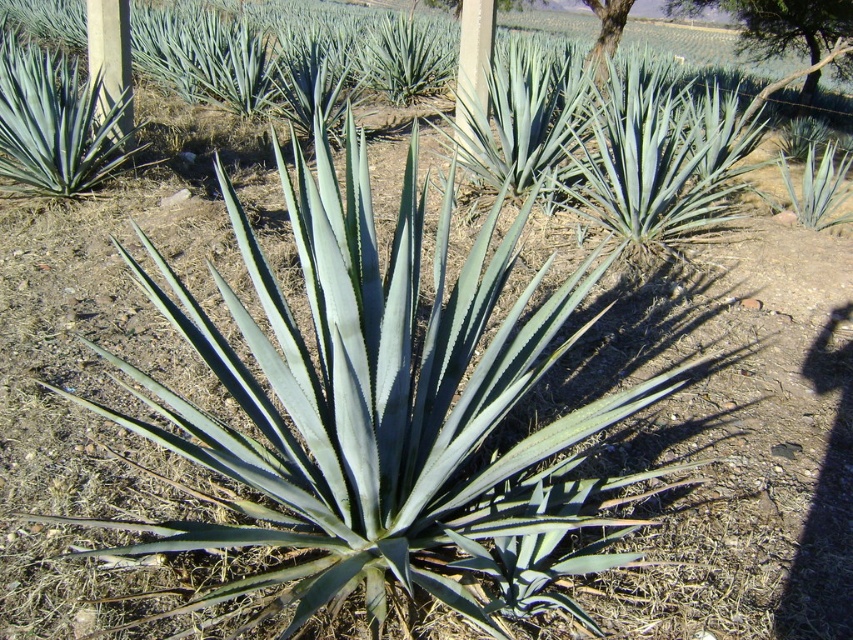
You are standing in the agave field and want to identify the tallest tree in the background. Which one is it between the green leafy tree at upper right and the smooth bark tree at upper right?

The green leafy tree at upper right is taller than the smooth bark tree at upper right, so the tallest tree is the green leafy tree at upper right.

You are standing in the agave field and want to determine which of the two points, point (129, 108) or point (471, 81), is closer to you. Based on the image, which point is nearer?

Point (129, 108) is closer to the camera than point (471, 81), so it is the nearer one.

You are standing in the agave field and want to walk from the green leafy tree at upper right to the smooth bark tree at upper right. How far will you have to walk?

The distance between the green leafy tree at upper right and the smooth bark tree at upper right is 4.85 meters, so you will have to walk 4.85 meters to get from one to the other.